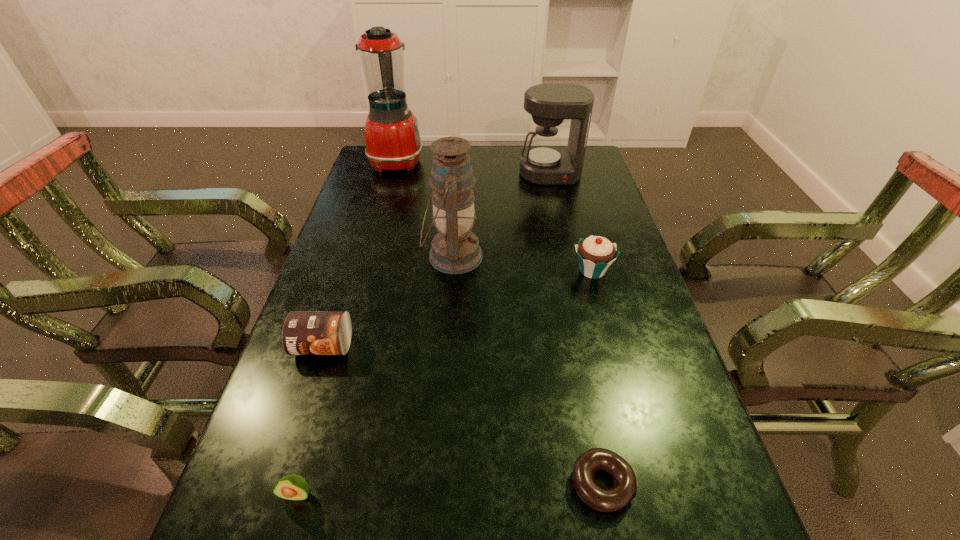
You are a GUI agent. You are given a task and a screenshot of the screen. Output one action in this format:
    pyautogui.click(x=<x>, y=<y>)
    Task: Click on the free spot that satisfies the following two spatial constraints: 1. on the controls of the food processor; 2. on the right side of the doughnut
    
    Given the screenshot: What is the action you would take?
    (305, 484)

You are a GUI agent. You are given a task and a screenshot of the screen. Output one action in this format:
    pyautogui.click(x=<x>, y=<y>)
    Task: Click on the free point that satisfies the following two spatial constraints: 1. on the controls of the tallest object; 2. on the back side of the fourth object from left to right
    Image resolution: width=960 pixels, height=540 pixels.
    Given the screenshot: What is the action you would take?
    pyautogui.click(x=370, y=256)

The image size is (960, 540). Identify the location of vacant region that satisfies the following two spatial constraints: 1. on the controls of the food processor; 2. on the left side of the doughnut. (305, 484).